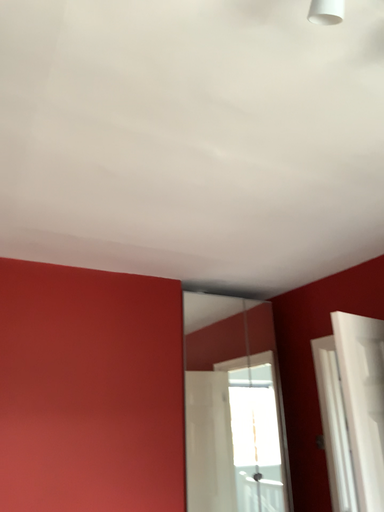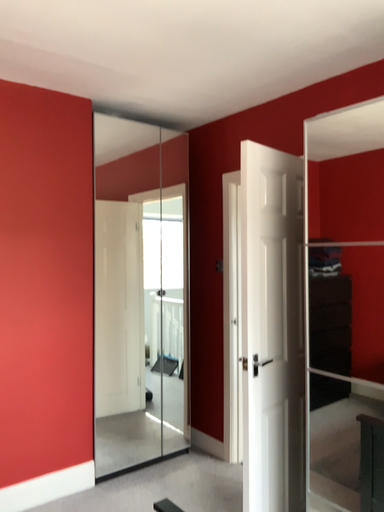
Question: How did the camera likely rotate when shooting the video?

Choices:
 (A) rotated upward
 (B) rotated downward

Answer: (B)